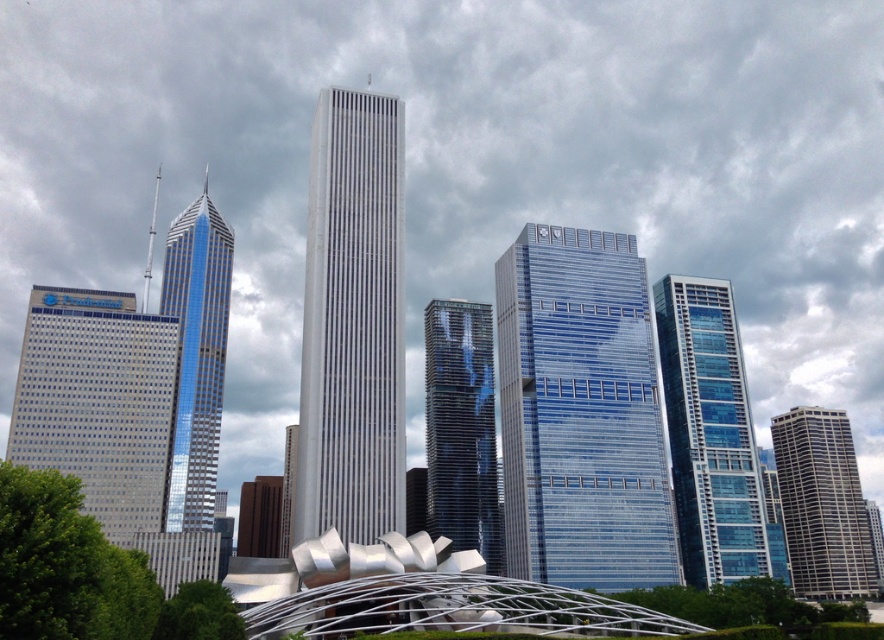
Based on the photo, you are standing in the city and want to take a photo of both the shiny glass skyscraper at left and the gray marble skyscraper at right. Which skyscraper will appear larger in your photo?

The shiny glass skyscraper at left will appear larger in the photo because it is closer to the viewer than the gray marble skyscraper at right.

You are an architect analyzing the city layout. Based on the scene, which skyscraper is positioned higher in the visual field between the blue glass skyscraper at center and the gray marble skyscraper at right?

The blue glass skyscraper at center is positioned higher in the visual field than the gray marble skyscraper at right according to the description.

You are an urban planner assessing the city layout. You need to determine which of the two skyscrapers, the shiny glass skyscraper at left or the gray marble skyscraper at right, has a smaller footprint in the city plan. Which one should you choose?

The shiny glass skyscraper at left occupies less space than gray marble skyscraper at right, so you should choose the shiny glass skyscraper at left as it has a smaller footprint.